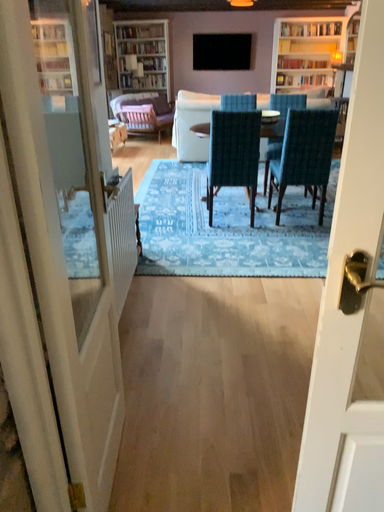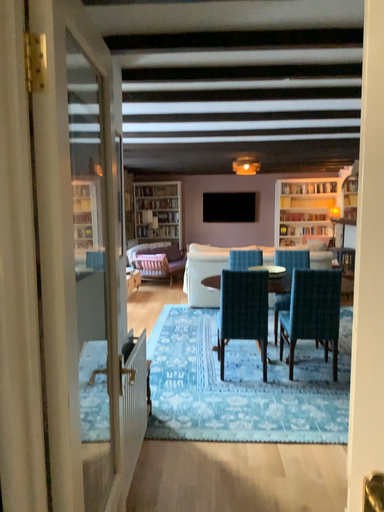
Question: How did the camera likely rotate when shooting the video?

Choices:
 (A) rotated upward
 (B) rotated downward

Answer: (A)